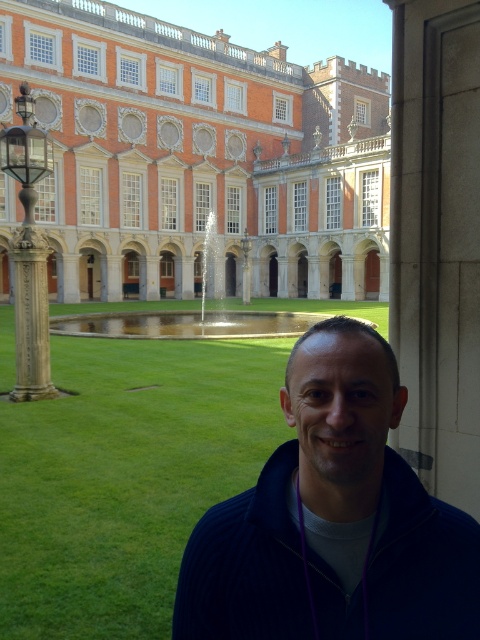
Question: Does green grass at lower center have a lesser width compared to dark blue sweater at lower right?

Choices:
 (A) no
 (B) yes

Answer: (A)

Question: Among these objects, which one is farthest from the camera?

Choices:
 (A) green grass at lower center
 (B) orange brick building at center

Answer: (B)

Question: Which point is closer to the camera?

Choices:
 (A) (141, 602)
 (B) (252, 547)
 (C) (7, 92)

Answer: (B)

Question: Which point is closer to the camera?

Choices:
 (A) (206, 400)
 (B) (358, 513)
 (C) (195, 113)

Answer: (B)

Question: Does orange brick building at center have a lesser width compared to green grass at lower center?

Choices:
 (A) no
 (B) yes

Answer: (A)

Question: Is orange brick building at center wider than dark blue sweater at lower right?

Choices:
 (A) no
 (B) yes

Answer: (B)